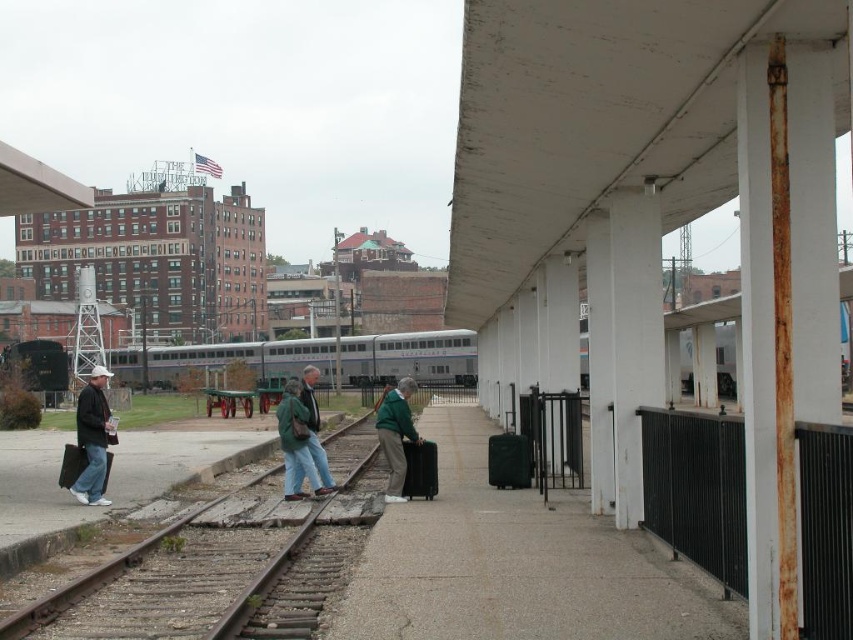
Can you confirm if rusty metal train track at lower left is smaller than matte black suitcase at left?

Actually, rusty metal train track at lower left might be larger than matte black suitcase at left.

Image resolution: width=853 pixels, height=640 pixels. Describe the element at coordinates (102, 572) in the screenshot. I see `rusty metal train track at lower left` at that location.

At what (x,y) coordinates should I click in order to perform the action: click on rusty metal train track at lower left. Please return your answer as a coordinate pair (x, y). The image size is (853, 640). Looking at the image, I should click on (102, 572).

Who is higher up, silver metallic train at center or matte black suitcase at center?

silver metallic train at center

Who is taller, silver metallic train at center or matte black suitcase at center?

silver metallic train at center is taller.

Looking at this image, who is more forward, [206,346] or [509,483]?

Positioned in front is point [509,483].

I want to click on silver metallic train at center, so click(410, 356).

Can you confirm if dark brown leather jacket at left is shorter than green wool jacket at center?

Yes, dark brown leather jacket at left is shorter than green wool jacket at center.

Does dark brown leather jacket at left have a greater height compared to green wool jacket at center?

In fact, dark brown leather jacket at left may be shorter than green wool jacket at center.

Does point (88, 416) lie behind point (378, 413)?

No, it is not.

This screenshot has width=853, height=640. What are the coordinates of `dark brown leather jacket at left` in the screenshot? It's located at (93, 438).